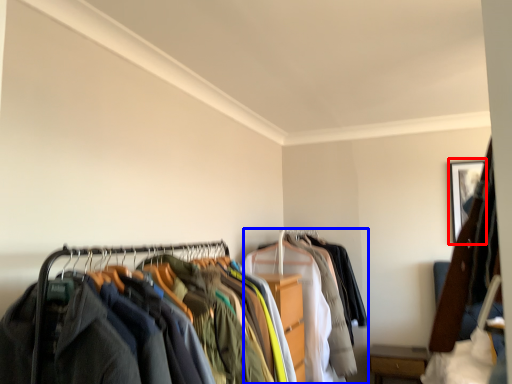
Question: Which point is further to the camera, picture frame (highlighted by a red box) or garment (highlighted by a blue box)?

Choices:
 (A) picture frame
 (B) garment

Answer: (A)